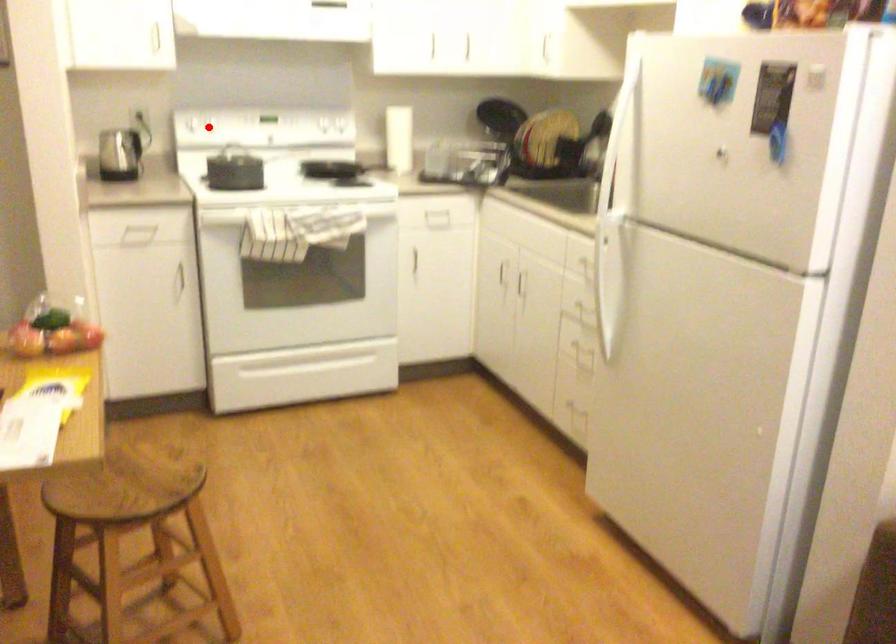
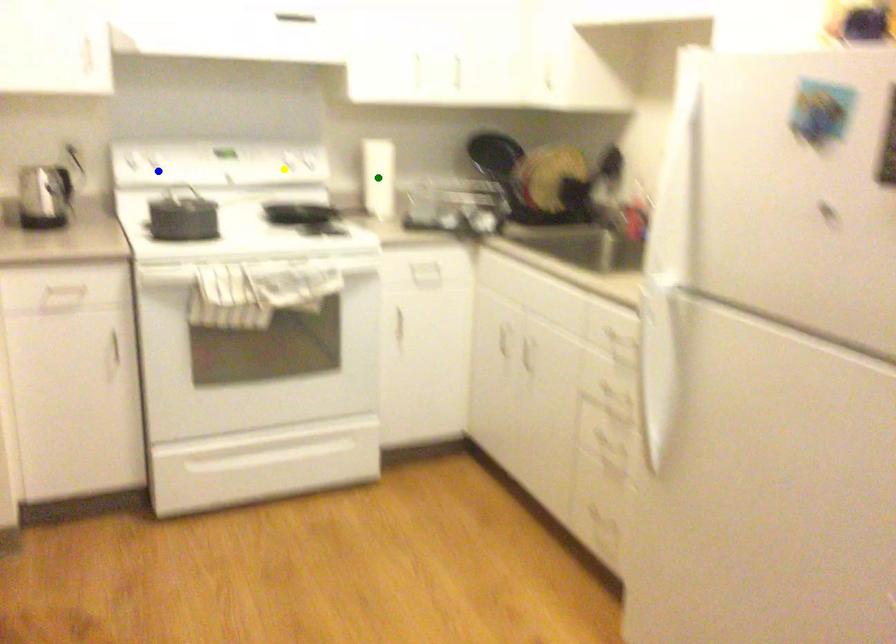
Question: I am providing you with two images of the same scene from different viewpoints. A red point is marked on the first image. You are given multiple points on the second image. Can you choose the point in image 2 that corresponds to the point in image 1?

Choices:
 (A) green point
 (B) yellow point
 (C) blue point

Answer: (C)